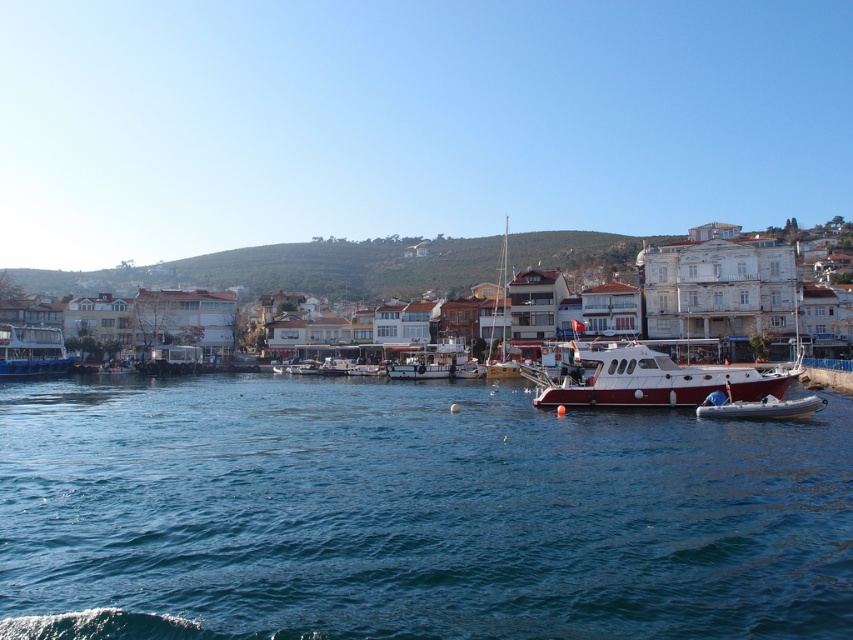
Is blue water at center bigger than white matte building at center?

No.

Is blue water at center positioned at the back of white matte building at center?

No, it is not.

In order to click on blue water at center in this screenshot , I will do `click(410, 513)`.

Locate an element on the screen. The width and height of the screenshot is (853, 640). blue water at center is located at coordinates (410, 513).

Who is lower down, red polished wood boat at center or blue metallic boat at left?

Positioned lower is blue metallic boat at left.

Does point (590, 353) come farther from viewer compared to point (39, 348)?

No, (590, 353) is in front of (39, 348).

The height and width of the screenshot is (640, 853). I want to click on red polished wood boat at center, so click(650, 378).

The image size is (853, 640). I want to click on red polished wood boat at center, so [650, 378].

Can you confirm if blue water at center is taller than blue metallic boat at left?

No.

Image resolution: width=853 pixels, height=640 pixels. Describe the element at coordinates (410, 513) in the screenshot. I see `blue water at center` at that location.

Which is behind, point (378, 449) or point (6, 339)?

Point (6, 339)

Where is `blue water at center`? The image size is (853, 640). blue water at center is located at coordinates (410, 513).